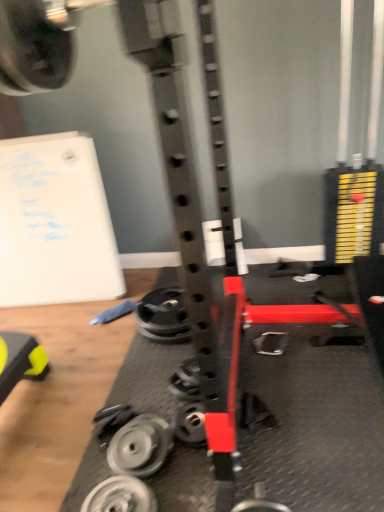
Question: Considering the relative positions of metallic silver wheel at center, which is the 3th wheel from bottom to top, and metallic silver weight at center, arranged as the first wheel when viewed from the back, in the image provided, is metallic silver wheel at center, which is the 3th wheel from bottom to top, to the right of metallic silver weight at center, arranged as the first wheel when viewed from the back, from the viewer's perspective?

Choices:
 (A) yes
 (B) no

Answer: (A)

Question: From the image's perspective, would you say metallic silver wheel at center, placed as the second wheel when sorted from back to front, is positioned over metallic silver weight at center, arranged as the first wheel when viewed from the back?

Choices:
 (A) no
 (B) yes

Answer: (A)

Question: Is metallic silver wheel at center, placed as the second wheel when sorted from back to front, touching metallic silver weight at center, arranged as the first wheel when viewed from the back?

Choices:
 (A) yes
 (B) no

Answer: (B)

Question: Does metallic silver wheel at center, which is the 3th wheel from bottom to top, have a larger size compared to metallic silver weight at center, arranged as the first wheel when viewed from the back?

Choices:
 (A) no
 (B) yes

Answer: (A)

Question: Considering the relative sizes of metallic silver wheel at center, placed as the second wheel when sorted from back to front, and metallic silver weight at center, the 1th wheel positioned from the top, in the image provided, is metallic silver wheel at center, placed as the second wheel when sorted from back to front, smaller than metallic silver weight at center, the 1th wheel positioned from the top,?

Choices:
 (A) yes
 (B) no

Answer: (A)

Question: From a real-world perspective, is silver metallic weight at center-left, the 2th wheel from the front, above or below metallic silver weight at center, which appears as the fourth wheel when viewed from the front?

Choices:
 (A) below
 (B) above

Answer: (B)

Question: In terms of width, does silver metallic weight at center-left, which is the second wheel from bottom to top, look wider or thinner when compared to metallic silver weight at center, which appears as the fourth wheel when viewed from the front?

Choices:
 (A) wide
 (B) thin

Answer: (B)

Question: Is silver metallic weight at center-left, which is the second wheel from bottom to top, taller or shorter than metallic silver weight at center, which appears as the fourth wheel when viewed from the front?

Choices:
 (A) short
 (B) tall

Answer: (A)

Question: Considering the relative positions of silver metallic weight at center-left, which is the second wheel from bottom to top, and metallic silver weight at center, the 1th wheel positioned from the top, in the image provided, is silver metallic weight at center-left, which is the second wheel from bottom to top, to the left or to the right of metallic silver weight at center, the 1th wheel positioned from the top,?

Choices:
 (A) right
 (B) left

Answer: (B)

Question: In the image, is silver metallic weight at center-left, which is the third wheel in back-to-front order, on the left side or the right side of silver metallic weight at lower center, marked as the first wheel in a front-to-back arrangement?

Choices:
 (A) right
 (B) left

Answer: (A)

Question: Is silver metallic weight at center-left, positioned as the 3th wheel in top-to-bottom order, situated inside silver metallic weight at lower center, which is counted as the 4th wheel, starting from the back, or outside?

Choices:
 (A) outside
 (B) inside

Answer: (A)

Question: Is point (144, 446) positioned closer to the camera than point (97, 494)?

Choices:
 (A) closer
 (B) farther

Answer: (B)

Question: Considering the positions of silver metallic weight at center-left, which is the second wheel from bottom to top, and silver metallic weight at lower center, marked as the first wheel in a front-to-back arrangement, in the image, is silver metallic weight at center-left, which is the second wheel from bottom to top, wider or thinner than silver metallic weight at lower center, marked as the first wheel in a front-to-back arrangement,?

Choices:
 (A) thin
 (B) wide

Answer: (A)

Question: From a real-world perspective, is silver metallic weight at center-left, which is the second wheel from bottom to top, positioned above or below metallic silver wheel at center, which is the 3th wheel from bottom to top?

Choices:
 (A) below
 (B) above

Answer: (B)

Question: Is silver metallic weight at center-left, the 2th wheel from the front, taller or shorter than metallic silver wheel at center, placed as the second wheel when sorted from back to front?

Choices:
 (A) tall
 (B) short

Answer: (A)